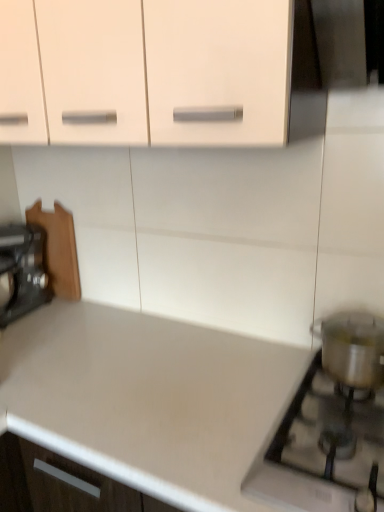
The image size is (384, 512). In order to click on free region on the left part of satin silver pot at lower right in this screenshot , I will do `click(192, 419)`.